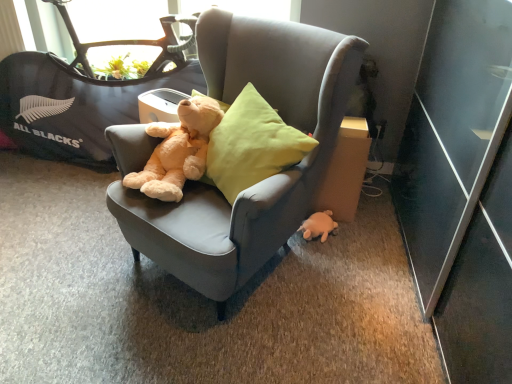
This screenshot has width=512, height=384. Identify the location of vacant point to the right of cardboard at right. (373, 221).